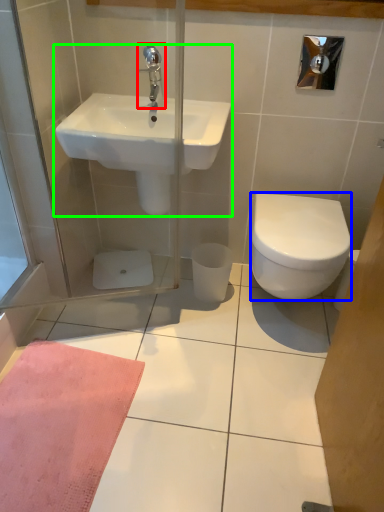
Question: Which is nearer to the tap (highlighted by a red box)? bidet (highlighted by a blue box) or sink (highlighted by a green box).

Choices:
 (A) bidet
 (B) sink

Answer: (B)